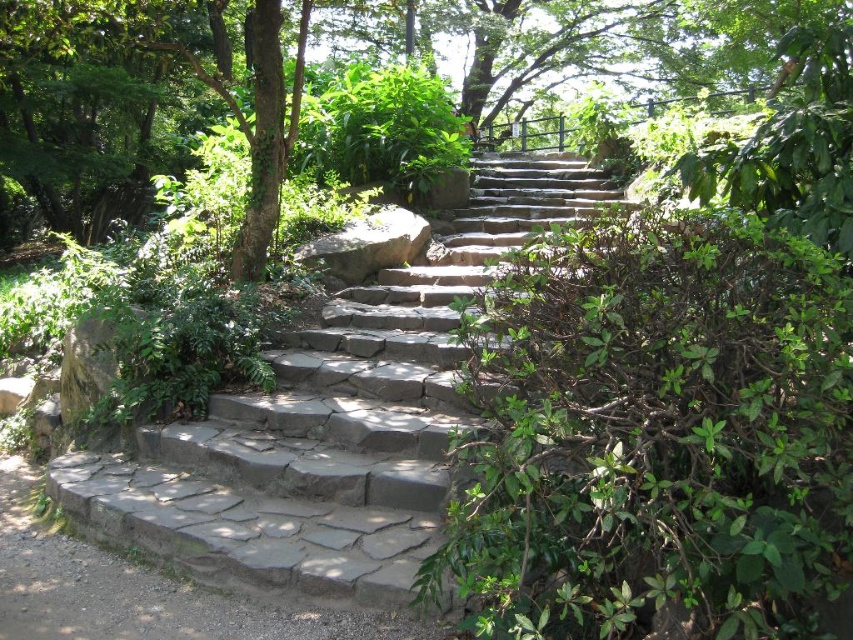
You are hiking up a mountain trail and come across a fork in the path. To your right, you see the gray stone stairs at center, and to your left, the gray stone steps at lower left. Which path should you take if you want to stay on the main trail?

You should take the gray stone stairs at center because it is positioned on the right side of gray stone steps at lower left, indicating it is the main trail.

You are a hiker carrying a heavy backpack and need to climb the gray stone stairs at center. There is a gray rough rock at center nearby. How far apart are these two landmarks?

The gray stone stairs at center is 1.00 meters from the gray rough rock at center, so they are relatively close to each other.